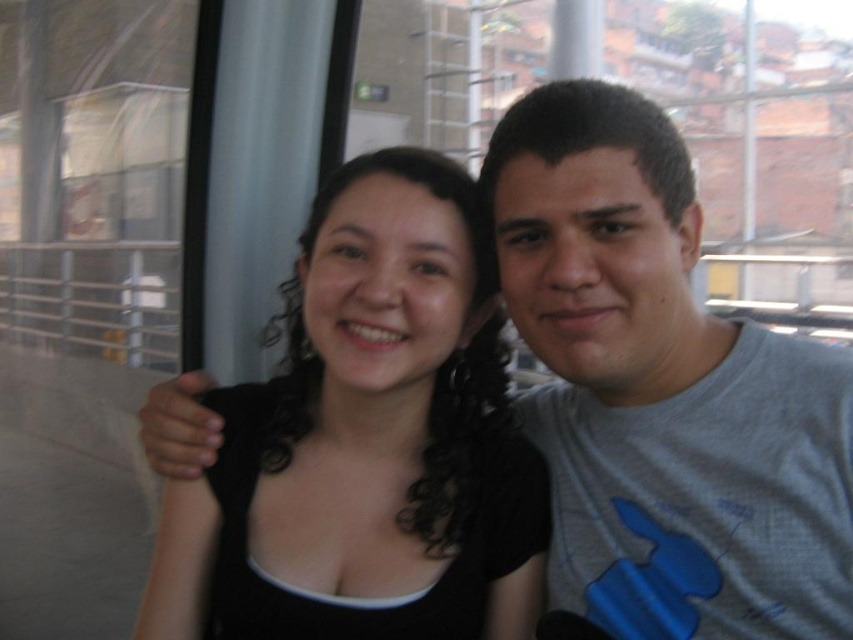
Question: Is gray cotton t-shirt at right smaller than black matte hair at center?

Choices:
 (A) no
 (B) yes

Answer: (B)

Question: Is the position of gray cotton t-shirt at right more distant than that of black matte hair at center?

Choices:
 (A) yes
 (B) no

Answer: (B)

Question: Does gray cotton t-shirt at right lie behind black matte hair at center?

Choices:
 (A) yes
 (B) no

Answer: (B)

Question: Among these points, which one is farthest from the camera?

Choices:
 (A) (706, 381)
 (B) (231, 548)

Answer: (B)